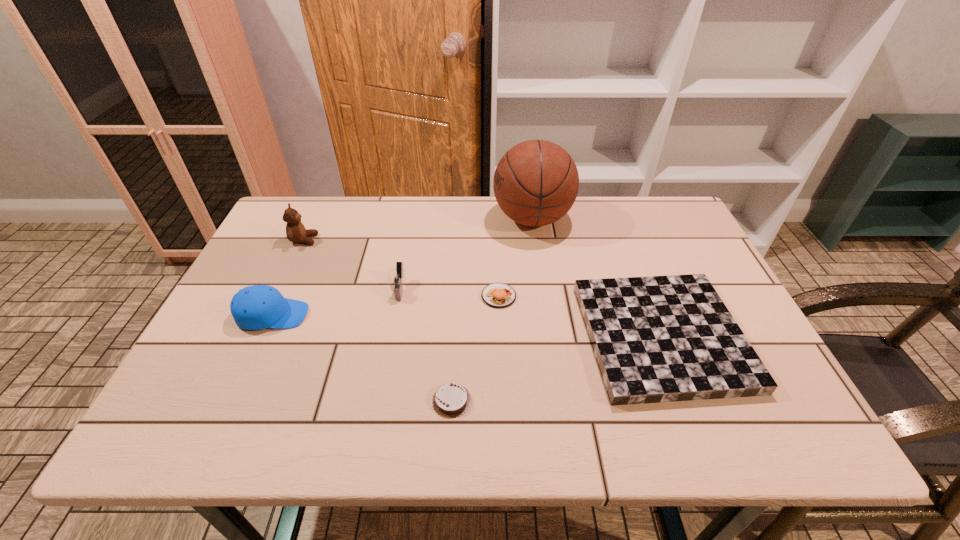
You are a GUI agent. You are given a task and a screenshot of the screen. Output one action in this format:
    pyautogui.click(x=<x>, y=<y>)
    Task: Click on the blank space at the near left corner of the desktop
    Image resolution: width=960 pixels, height=540 pixels.
    Given the screenshot: What is the action you would take?
    pyautogui.click(x=169, y=438)

This screenshot has width=960, height=540. I want to click on vacant point at the far right corner, so click(x=648, y=223).

You are a GUI agent. You are given a task and a screenshot of the screen. Output one action in this format:
    pyautogui.click(x=<x>, y=<y>)
    Task: Click on the free point between the third object from left to right and the cap
    
    Given the screenshot: What is the action you would take?
    pyautogui.click(x=337, y=302)

Identify the location of vacant area that lies between the teddy bear and the cap. (288, 278).

Image resolution: width=960 pixels, height=540 pixels. What are the coordinates of `free space between the igniter and the teddy bear` in the screenshot? It's located at (352, 265).

Locate an element on the screen. The width and height of the screenshot is (960, 540). vacant area that lies between the tallest object and the checkerboard is located at coordinates (597, 278).

Image resolution: width=960 pixels, height=540 pixels. What are the coordinates of `vacant area between the chocolate cake and the sixth shortest object` in the screenshot? It's located at (378, 320).

Where is `free spot between the teddy bear and the cap`? The height and width of the screenshot is (540, 960). free spot between the teddy bear and the cap is located at coordinates (288, 278).

Find the location of a particular element. vacant area that lies between the fifth tallest object and the second shortest object is located at coordinates (580, 316).

Where is `free space between the teddy bear and the fifth object from right to left`? The height and width of the screenshot is (540, 960). free space between the teddy bear and the fifth object from right to left is located at coordinates (352, 265).